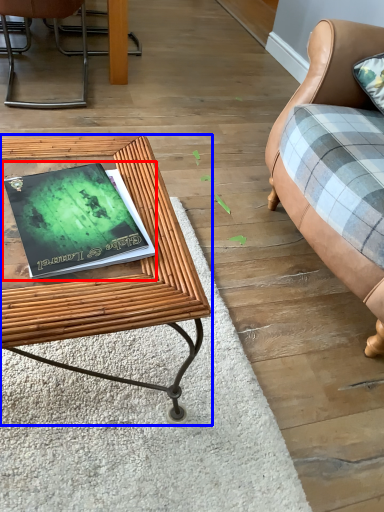
Question: Among these objects, which one is nearest to the camera, paperback book (highlighted by a red box) or table (highlighted by a blue box)?

Choices:
 (A) paperback book
 (B) table

Answer: (B)